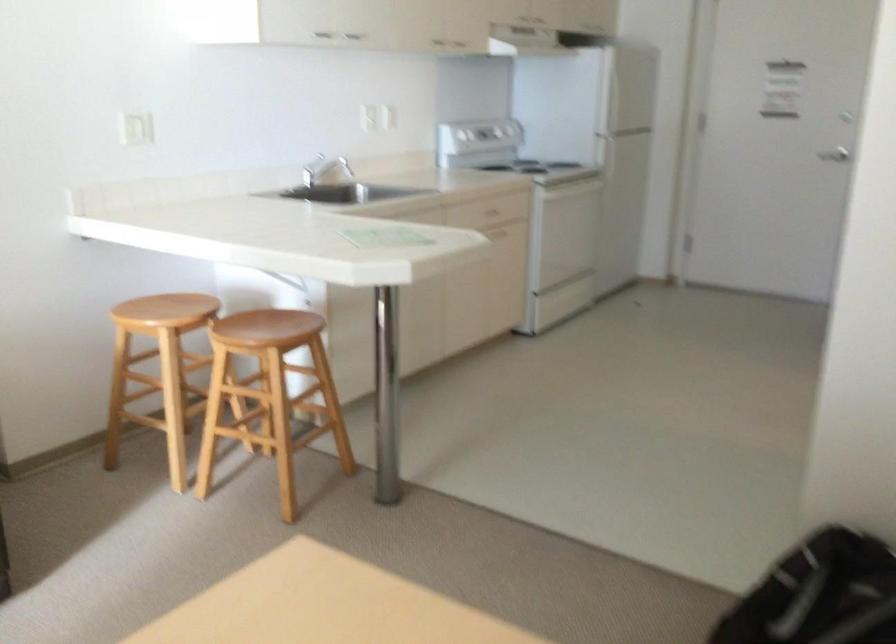
Find the location of a particular element. The height and width of the screenshot is (644, 896). white stove knob is located at coordinates (478, 135).